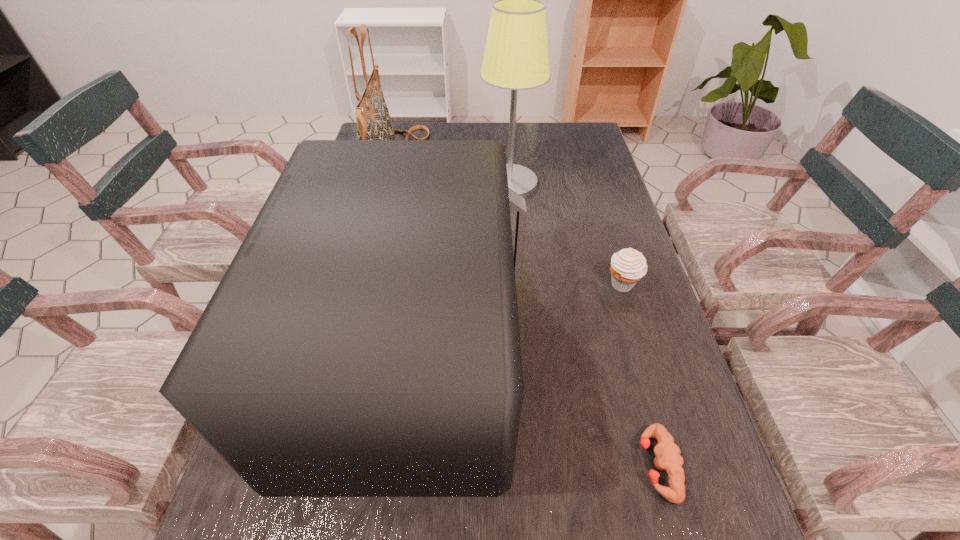
Find the location of a particular element. This screenshot has width=960, height=540. vacant space located with the gloves of the puncher facing forward is located at coordinates (419, 465).

Where is `free spot located 0.090m with the gloves of the puncher facing forward`? free spot located 0.090m with the gloves of the puncher facing forward is located at coordinates (588, 465).

The width and height of the screenshot is (960, 540). In order to click on object positioned at the far edge in this screenshot , I will do `click(373, 119)`.

At what (x,y) coordinates should I click in order to perform the action: click on handbag situated at the left edge. Please return your answer as a coordinate pair (x, y). The height and width of the screenshot is (540, 960). Looking at the image, I should click on (373, 119).

This screenshot has height=540, width=960. I want to click on microwave oven situated at the left edge, so click(364, 341).

The image size is (960, 540). Find the location of `muffin at the right edge`. muffin at the right edge is located at coordinates (628, 266).

Find the location of a particular element. The height and width of the screenshot is (540, 960). puncher at the right edge is located at coordinates (667, 453).

Image resolution: width=960 pixels, height=540 pixels. What are the coordinates of `object present at the far left corner` in the screenshot? It's located at (373, 119).

In the image, there is a desktop. Where is `vacant region at the right edge`? Image resolution: width=960 pixels, height=540 pixels. vacant region at the right edge is located at coordinates (714, 477).

What are the coordinates of `vacant space at the far right corner of the desktop` in the screenshot? It's located at (573, 133).